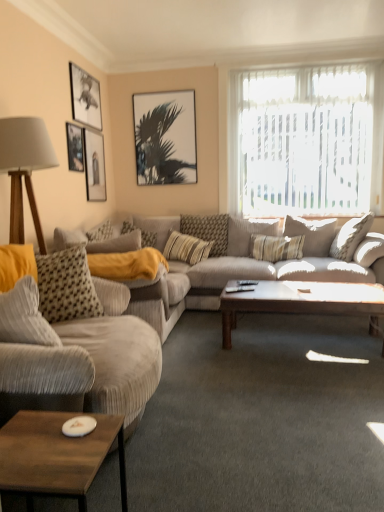
Question: From the image's perspective, is matte black picture frame at upper left, the second picture frame when ordered from right to left, located above striped fabric pillow at center, which is the 2th pillow in right-to-left order?

Choices:
 (A) yes
 (B) no

Answer: (A)

Question: Could you tell me if matte black picture frame at upper left, the second picture frame when ordered from right to left, is facing striped fabric pillow at center, positioned as the fourth pillow in left-to-right order?

Choices:
 (A) yes
 (B) no

Answer: (A)

Question: From a real-world perspective, does matte black picture frame at upper left, the second picture frame when ordered from right to left, sit lower than striped fabric pillow at center, positioned as the fourth pillow in left-to-right order?

Choices:
 (A) yes
 (B) no

Answer: (B)

Question: From the image's perspective, is matte black picture frame at upper left, the second picture frame when ordered from right to left, located beneath striped fabric pillow at center, positioned as the fourth pillow in left-to-right order?

Choices:
 (A) yes
 (B) no

Answer: (B)

Question: Does matte black picture frame at upper left, the second picture frame when ordered from right to left, come behind striped fabric pillow at center, which is the 2th pillow in right-to-left order?

Choices:
 (A) no
 (B) yes

Answer: (A)

Question: Looking at their shapes, would you say yellow corduroy pillow at center, positioned as the fifth pillow in right-to-left order, is wider or thinner than matte black picture frame at upper left, which appears as the 3th picture frame when viewed from the right?

Choices:
 (A) thin
 (B) wide

Answer: (B)

Question: Choose the correct answer: Is yellow corduroy pillow at center, which is the first pillow in left-to-right order, inside matte black picture frame at upper left, which appears as the 3th picture frame when viewed from the right, or outside it?

Choices:
 (A) outside
 (B) inside

Answer: (A)

Question: Considering the relative positions of yellow corduroy pillow at center, which is the first pillow in left-to-right order, and matte black picture frame at upper left, which appears as the 3th picture frame when viewed from the right, in the image provided, is yellow corduroy pillow at center, which is the first pillow in left-to-right order, to the left or to the right of matte black picture frame at upper left, which appears as the 3th picture frame when viewed from the right,?

Choices:
 (A) left
 (B) right

Answer: (B)

Question: Relative to matte black picture frame at upper left, arranged as the second picture frame when viewed from the left, is yellow corduroy pillow at center, which is the first pillow in left-to-right order, in front or behind?

Choices:
 (A) front
 (B) behind

Answer: (B)

Question: Considering their positions, is matte black picture frame at upper left, which appears as the 3th picture frame when viewed from the right, located in front of or behind striped fabric pillow at center, arranged as the 3th pillow when viewed from the right?

Choices:
 (A) behind
 (B) front

Answer: (B)

Question: From a real-world perspective, is matte black picture frame at upper left, which appears as the 3th picture frame when viewed from the right, positioned above or below striped fabric pillow at center, positioned as the third pillow in left-to-right order?

Choices:
 (A) above
 (B) below

Answer: (A)

Question: In terms of width, does matte black picture frame at upper left, arranged as the second picture frame when viewed from the left, look wider or thinner when compared to striped fabric pillow at center, positioned as the third pillow in left-to-right order?

Choices:
 (A) wide
 (B) thin

Answer: (B)

Question: From the image's perspective, is matte black picture frame at upper left, which appears as the 3th picture frame when viewed from the right, above or below striped fabric pillow at center, positioned as the third pillow in left-to-right order?

Choices:
 (A) below
 (B) above

Answer: (B)

Question: From their relative heights in the image, would you say translucent fabric at upper right is taller or shorter than striped fabric pillow at center, arranged as the 3th pillow when viewed from the right?

Choices:
 (A) short
 (B) tall

Answer: (B)

Question: Is translucent fabric at upper right to the left or to the right of striped fabric pillow at center, positioned as the third pillow in left-to-right order, in the image?

Choices:
 (A) left
 (B) right

Answer: (B)